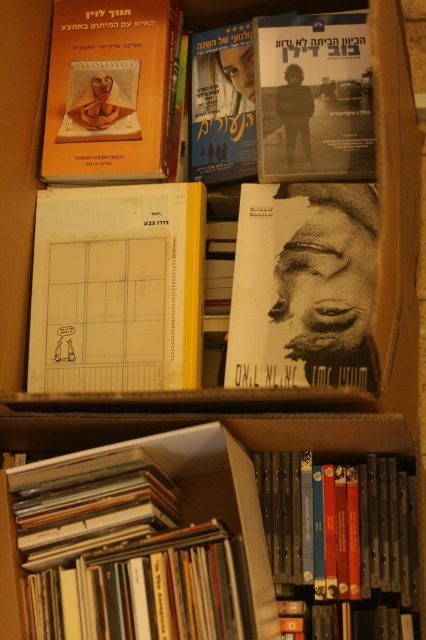
Question: Which point is closer to the camera taking this photo?

Choices:
 (A) (285, 120)
 (B) (265, 195)

Answer: (A)

Question: Can you confirm if white paper at center is positioned to the left of black paper book at center?

Choices:
 (A) yes
 (B) no

Answer: (A)

Question: Which point is farther to the camera?

Choices:
 (A) black matte dvd case at lower right
 (B) matte paper book at upper left
 (C) black paper book at center
 (D) matte paper movie poster at upper center

Answer: (D)

Question: Is white paper at center closer to camera compared to matte paper movie poster at upper center?

Choices:
 (A) yes
 (B) no

Answer: (A)

Question: Is black matte book at upper center below matte paper movie poster at upper center?

Choices:
 (A) no
 (B) yes

Answer: (B)

Question: Which of the following is the closest to the observer?

Choices:
 (A) black matte book at upper center
 (B) black matte dvd case at lower right
 (C) matte paper book at upper left
 (D) white paper at center

Answer: (B)